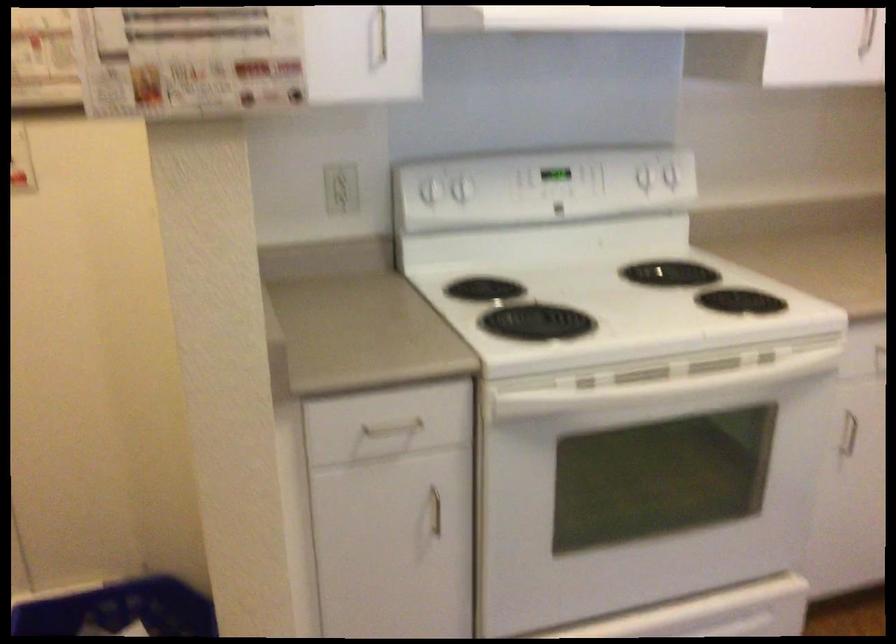
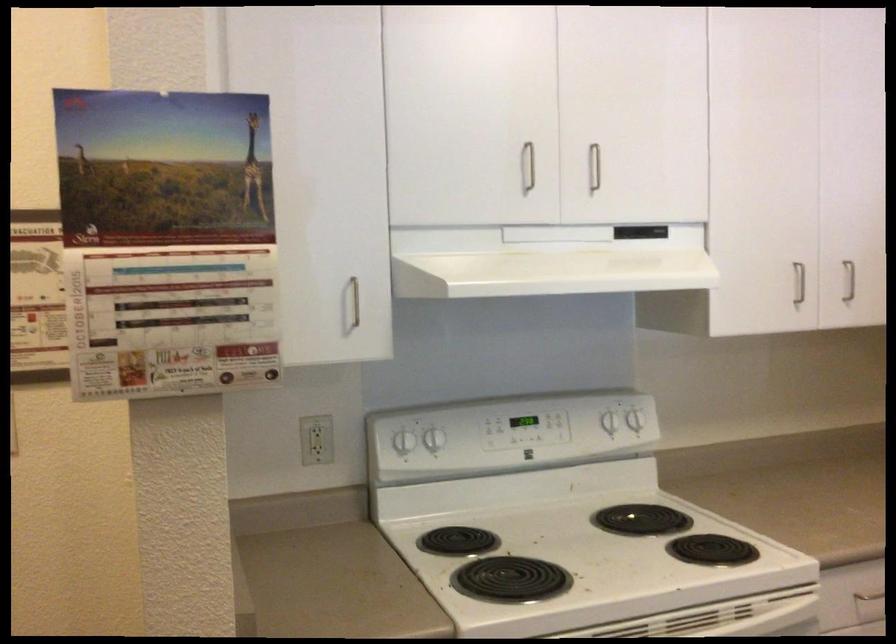
Find the pixel in the second image that matches pixel 643 174 in the first image.

(608, 422)